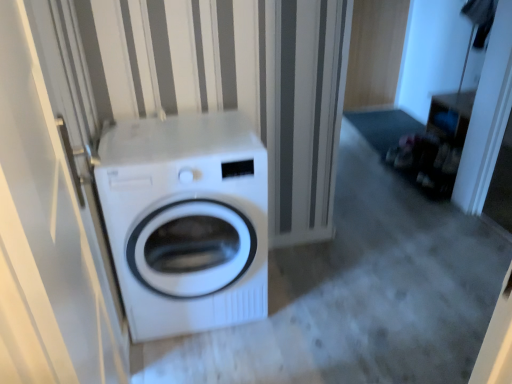
Question: Is white glossy washing machine at center thinner than white glossy door at left?

Choices:
 (A) no
 (B) yes

Answer: (A)

Question: Is white glossy washing machine at center positioned with its back to white glossy door at left?

Choices:
 (A) no
 (B) yes

Answer: (A)

Question: Can you confirm if white glossy washing machine at center is smaller than white glossy door at left?

Choices:
 (A) no
 (B) yes

Answer: (A)

Question: Can you confirm if white glossy washing machine at center is positioned to the left of white glossy door at left?

Choices:
 (A) yes
 (B) no

Answer: (B)

Question: From a real-world perspective, is white glossy washing machine at center physically below white glossy door at left?

Choices:
 (A) no
 (B) yes

Answer: (B)

Question: Is white glossy washing machine at center positioned beyond the bounds of white glossy door at left?

Choices:
 (A) no
 (B) yes

Answer: (B)

Question: From a real-world perspective, is white glossy door at left on top of white glossy washing machine at center?

Choices:
 (A) yes
 (B) no

Answer: (A)

Question: Is the depth of white glossy door at left greater than that of white glossy washing machine at center?

Choices:
 (A) yes
 (B) no

Answer: (B)

Question: From a real-world perspective, is white glossy door at left positioned under white glossy washing machine at center based on gravity?

Choices:
 (A) yes
 (B) no

Answer: (B)

Question: Is white glossy door at left oriented towards white glossy washing machine at center?

Choices:
 (A) no
 (B) yes

Answer: (A)

Question: Does white glossy door at left appear on the left side of white glossy washing machine at center?

Choices:
 (A) no
 (B) yes

Answer: (B)

Question: Does white glossy door at left have a lesser height compared to white glossy washing machine at center?

Choices:
 (A) yes
 (B) no

Answer: (B)

Question: Is white glossy washing machine at center situated inside white glossy door at left or outside?

Choices:
 (A) outside
 (B) inside

Answer: (A)